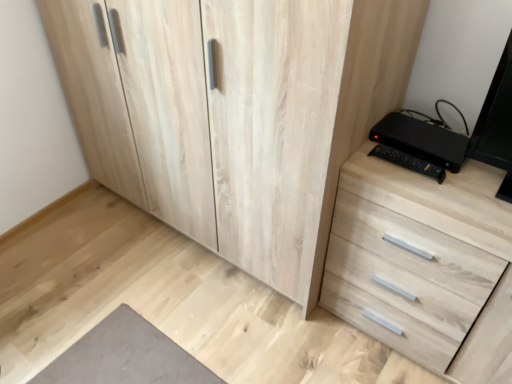
In order to face black plastic at right, should I rotate leftwards or rightwards?

You should look right and rotate roughly 21.647 degrees.

Where is `natural wood cupboard at center`? Image resolution: width=512 pixels, height=384 pixels. natural wood cupboard at center is located at coordinates (234, 113).

Find the location of `black plastic at right`. black plastic at right is located at coordinates (421, 140).

Looking at this image, is light wood chest of drawers at right taller than natural wood cupboard at center?

No.

From a real-world perspective, is light wood chest of drawers at right physically below natural wood cupboard at center?

Yes.

Does light wood chest of drawers at right lie in front of natural wood cupboard at center?

No, light wood chest of drawers at right is further to the viewer.

How different are the orientations of black plastic at right and light wood chest of drawers at right in degrees?

The angular difference between black plastic at right and light wood chest of drawers at right is 3.66 degrees.

Is black plastic at right to the left of light wood chest of drawers at right from the viewer's perspective?

Correct, you'll find black plastic at right to the left of light wood chest of drawers at right.

In the scene shown: Is black plastic at right turned away from light wood chest of drawers at right?

That's not correct — black plastic at right is not looking away from light wood chest of drawers at right.

Consider the image. Would you say black plastic at right is a long distance from light wood chest of drawers at right?

They are positioned close to each other.

Who is bigger, light wood chest of drawers at right or black plastic at right?

Bigger between the two is light wood chest of drawers at right.

Does point (406, 231) appear closer or farther from the camera than point (395, 142)?

Point (406, 231).

Considering the sizes of light wood chest of drawers at right and black plastic at right in the image, is light wood chest of drawers at right taller or shorter than black plastic at right?

Considering their sizes, light wood chest of drawers at right has more height than black plastic at right.

Is light wood chest of drawers at right in contact with black plastic at right?

There is a gap between light wood chest of drawers at right and black plastic at right.

Based on the photo, is natural wood cupboard at center facing away from black plastic at right?

No.

Is point (265, 85) closer to viewer compared to point (416, 148)?

Yes.

From a real-world perspective, is natural wood cupboard at center positioned above or below black plastic at right?

In terms of real-world spatial position, natural wood cupboard at center is below black plastic at right.

From a real-world perspective, which is physically above, black plastic at right or natural wood cupboard at center?

black plastic at right, from a real-world perspective.

Which is more to the right, black plastic at right or natural wood cupboard at center?

black plastic at right is more to the right.

Considering the sizes of objects black plastic at right and natural wood cupboard at center in the image provided, who is thinner, black plastic at right or natural wood cupboard at center?

Thinner between the two is black plastic at right.

Can you confirm if black plastic at right is bigger than natural wood cupboard at center?

No, black plastic at right is not bigger than natural wood cupboard at center.

Is there a large distance between natural wood cupboard at center and light wood chest of drawers at right?

No.

How many degrees apart are the facing directions of natural wood cupboard at center and light wood chest of drawers at right?

The facing directions of natural wood cupboard at center and light wood chest of drawers at right are 1.02 degrees apart.

Is natural wood cupboard at center to the left or to the right of light wood chest of drawers at right in the image?

Based on their positions, natural wood cupboard at center is located to the left of light wood chest of drawers at right.

From the picture: Considering the sizes of objects natural wood cupboard at center and light wood chest of drawers at right in the image provided, who is bigger, natural wood cupboard at center or light wood chest of drawers at right?

With larger size is natural wood cupboard at center.

Identify the location of the chest of drawers that appears below the natural wood cupboard at center (from the image's perspective). (416, 255).

The width and height of the screenshot is (512, 384). Find the location of `computer that appears above the light wood chest of drawers at right (from a real-world perspective)`. computer that appears above the light wood chest of drawers at right (from a real-world perspective) is located at coordinates (421, 140).

Estimate the real-world distances between objects in this image. Which object is closer to black plastic at right, light wood chest of drawers at right or natural wood cupboard at center?

light wood chest of drawers at right lies closer to black plastic at right than the other object.

Which object lies nearer to the anchor point light wood chest of drawers at right, natural wood cupboard at center or black plastic at right?

Among the two, black plastic at right is located nearer to light wood chest of drawers at right.

Which object lies nearer to the anchor point light wood chest of drawers at right, black plastic at right or natural wood cupboard at center?

black plastic at right.

From the picture: From the image, which object appears to be nearer to natural wood cupboard at center, black plastic at right or light wood chest of drawers at right?

light wood chest of drawers at right is closer to natural wood cupboard at center.

When comparing their distances from natural wood cupboard at center, does light wood chest of drawers at right or black plastic at right seem closer?

Among the two, light wood chest of drawers at right is located nearer to natural wood cupboard at center.

Looking at the image, which one is located closer to black plastic at right, natural wood cupboard at center or light wood chest of drawers at right?

light wood chest of drawers at right.

Locate an element on the screen. This screenshot has height=384, width=512. computer situated between natural wood cupboard at center and light wood chest of drawers at right from left to right is located at coordinates (421, 140).